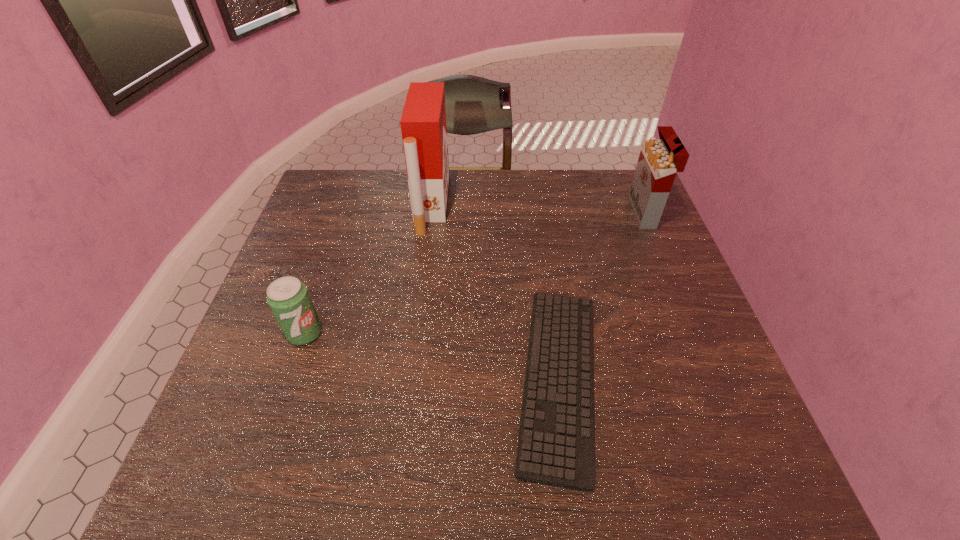
Image resolution: width=960 pixels, height=540 pixels. I want to click on the left cigarette case, so 423,124.

Where is `the tallest object`? The height and width of the screenshot is (540, 960). the tallest object is located at coordinates (423, 124).

Find the location of a particular element. This screenshot has height=540, width=960. the rightmost object is located at coordinates (659, 161).

Where is `the second tallest object`? the second tallest object is located at coordinates (659, 161).

Identify the location of the third tallest object. (288, 298).

Find the location of a particular element. Image resolution: width=960 pixels, height=540 pixels. soda is located at coordinates (288, 298).

Locate an element on the screen. The image size is (960, 540). the third object from left to right is located at coordinates (556, 443).

Identify the location of the shortest object. This screenshot has width=960, height=540. (556, 443).

I want to click on free space located 0.340m on the front-facing side of the third object from right to left, so click(x=558, y=204).

The image size is (960, 540). In order to click on free space located 0.340m with the lid open on the right cigarette case in this screenshot , I will do 519,213.